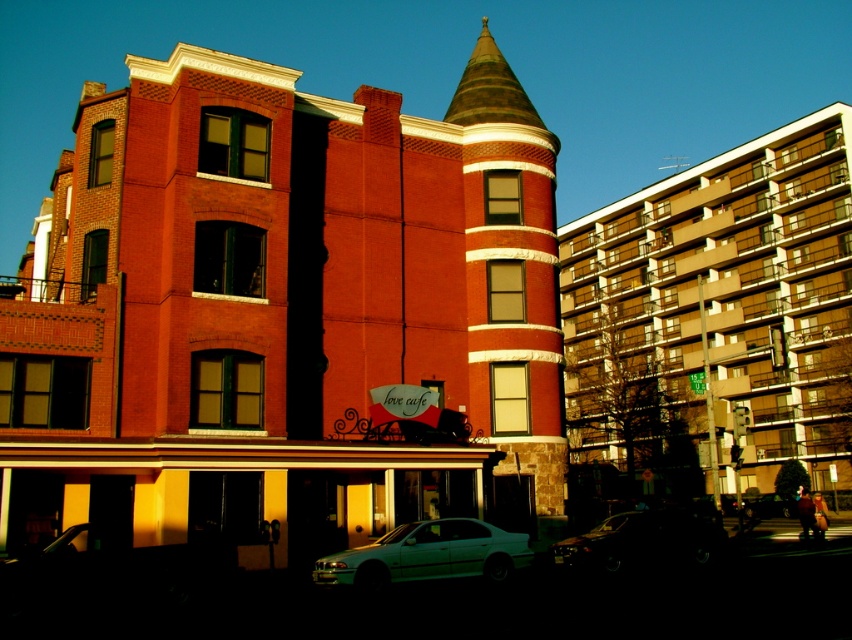
From the picture: You are a customer arriving at Love Cafe and see the white glossy sedan at lower center and the shiny black sedan at lower center. Which car is closer to the entrance of the cafe?

The white glossy sedan at lower center is closer to the entrance of the cafe because it is located above the shiny black sedan at lower center, which is further away from the entrance.

Consider the image. You are a delivery driver who needs to park your truck next to the white glossy sedan at lower center and the metallic silver sedan at center. Since your truck is 2 meters wide, can you park it between them without overlapping?

The white glossy sedan at lower center is wider than the metallic silver sedan at center. Since the truck is 2 meters wide, you need to check the available space between them. However, the exact distance between the two sedans isn t provided, so it s uncertain if there s enough space. Please measure the gap before attempting to park.